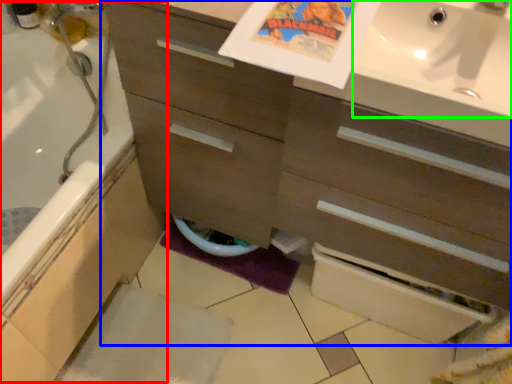
Question: Which object is positioned closest to bath (highlighted by a red box)? Select from bathroom cabinet (highlighted by a blue box) and sink (highlighted by a green box).

Choices:
 (A) bathroom cabinet
 (B) sink

Answer: (A)